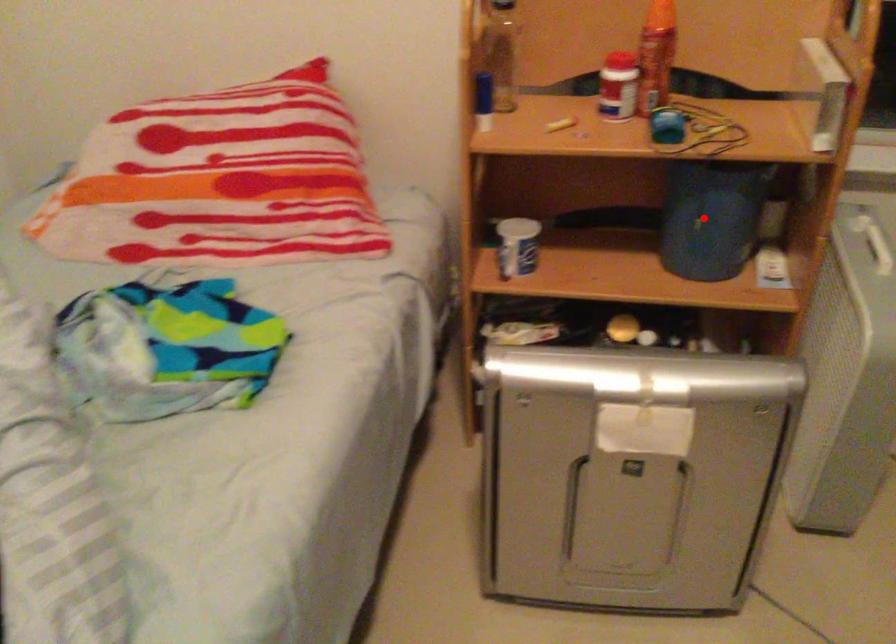
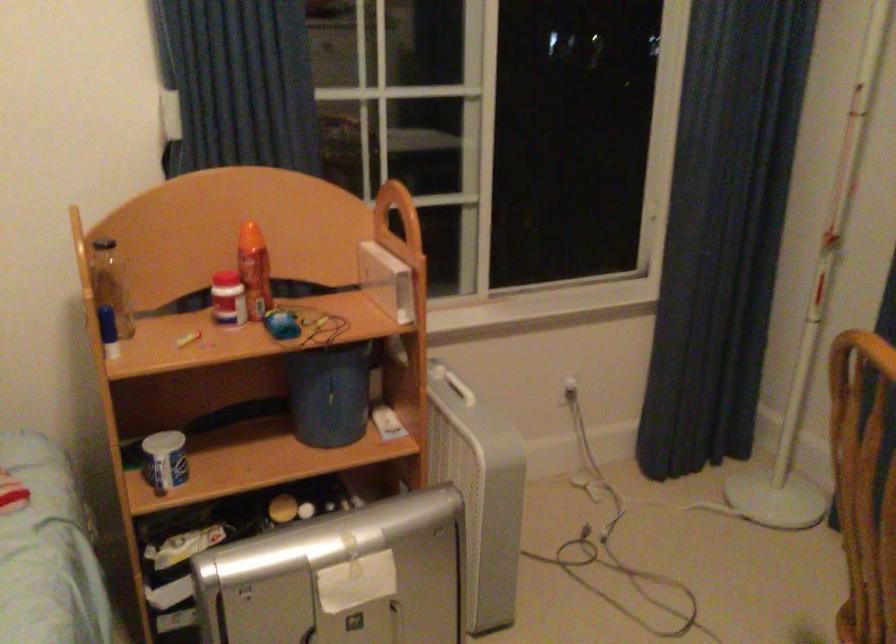
Question: I am providing you with two images of the same scene from different viewpoints. A red point is shown in image1. For the corresponding object point in image2, is it positioned nearer or farther from the camera?

Choices:
 (A) Nearer
 (B) Farther

Answer: (B)